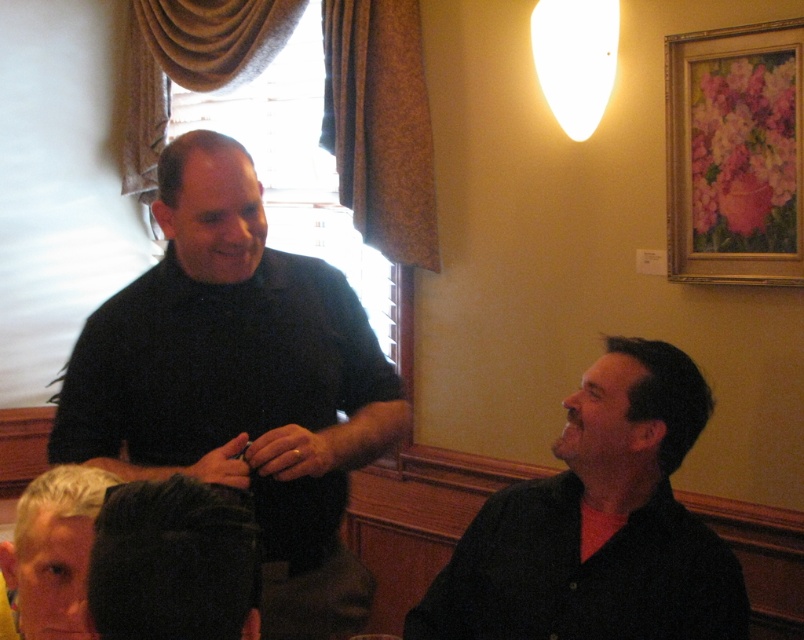
Does dark hair at lower left have a smaller size compared to blonde hair at lower left?

Yes, dark hair at lower left is smaller than blonde hair at lower left.

Does dark hair at lower left lie in front of blonde hair at lower left?

Yes, dark hair at lower left is closer to the viewer.

Which is in front, point (236, 504) or point (78, 605)?

Point (236, 504) is in front.

I want to click on dark hair at lower left, so click(173, 561).

Describe the element at coordinates (240, 381) in the screenshot. I see `black matte shirt at upper left` at that location.

Is point (355, 448) farther from viewer compared to point (18, 524)?

That is True.

At what (x,y) coordinates should I click in order to perform the action: click on black matte shirt at upper left. Please return your answer as a coordinate pair (x, y). Looking at the image, I should click on (240, 381).

Does black matte shirt at right lie in front of dark hair at lower left?

No, black matte shirt at right is further to the viewer.

Who is taller, black matte shirt at right or dark hair at lower left?

Standing taller between the two is black matte shirt at right.

I want to click on black matte shirt at right, so click(597, 525).